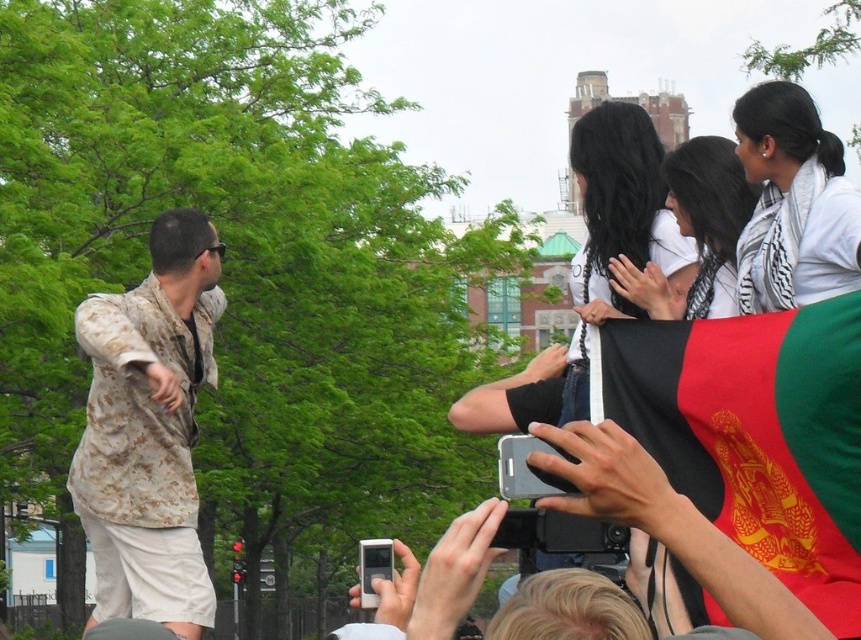
Question: Among these objects, which one is farthest from the camera?

Choices:
 (A) white scarf at upper right
 (B) camouflage fabric shirt at center
 (C) black silky hair at upper center

Answer: (C)

Question: Is black silky hair at upper center bigger than white scarf at upper right?

Choices:
 (A) yes
 (B) no

Answer: (A)

Question: Does black fabric flag at upper right lie in front of black silky hair at upper center?

Choices:
 (A) no
 (B) yes

Answer: (B)

Question: Which point is farther from the camera taking this photo?

Choices:
 (A) (571, 168)
 (B) (739, 113)

Answer: (A)

Question: Which of the following is the closest to the observer?

Choices:
 (A) camouflage fabric shirt at left
 (B) white scarf at upper right
 (C) black fabric flag at upper right
 (D) camouflage fabric shirt at center

Answer: (D)

Question: Is black silky hair at upper center positioned before white scarf at upper right?

Choices:
 (A) yes
 (B) no

Answer: (B)